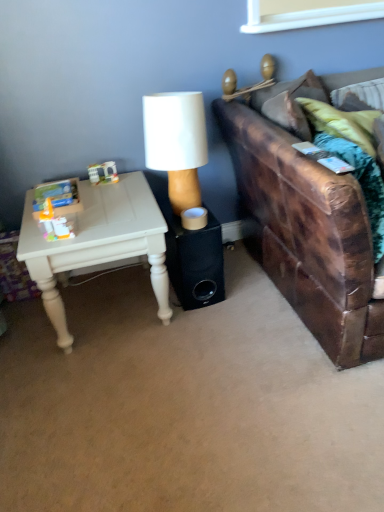
This screenshot has height=512, width=384. Describe the element at coordinates (176, 143) in the screenshot. I see `white matte lamp at center` at that location.

Image resolution: width=384 pixels, height=512 pixels. What do you see at coordinates (98, 243) in the screenshot?
I see `white painted wood table at left` at bounding box center [98, 243].

From the picture: What is the approximate width of black matte speaker at center?

black matte speaker at center is 14.01 inches wide.

At what (x,y) coordinates should I click in order to perform the action: click on brown leather couch at right. Please return your answer as a coordinate pair (x, y). The image size is (384, 512). Looking at the image, I should click on (306, 225).

Find the location of `studio couch beneath the white matte lamp at center (from a real-world perspective)`. studio couch beneath the white matte lamp at center (from a real-world perspective) is located at coordinates (306, 225).

Which is more to the left, white matte lamp at center or brown leather couch at right?

From the viewer's perspective, white matte lamp at center appears more on the left side.

From the image's perspective, is white matte lamp at center above brown leather couch at right?

Indeed, from the image's perspective, white matte lamp at center is shown above brown leather couch at right.

Is white matte lamp at center looking in the opposite direction of brown leather couch at right?

No, white matte lamp at center is not facing the opposite direction of brown leather couch at right.

Would you consider brown leather couch at right to be distant from white matte lamp at center?

That's not correct — brown leather couch at right is a little close to white matte lamp at center.

Which object is closer to the camera taking this photo, brown leather couch at right or white matte lamp at center?

Positioned in front is brown leather couch at right.

Which object is positioned more to the right, brown leather couch at right or white matte lamp at center?

Positioned to the right is brown leather couch at right.

Considering the sizes of brown leather couch at right and white matte lamp at center in the image, is brown leather couch at right taller or shorter than white matte lamp at center?

brown leather couch at right is taller than white matte lamp at center.

From the image's perspective, which is above, white painted wood table at left or black matte speaker at center?

black matte speaker at center.

Which is in front, point (93, 201) or point (196, 290)?

The point (93, 201) is closer.

Considering the relative positions of white painted wood table at left and black matte speaker at center in the image provided, is white painted wood table at left in front of black matte speaker at center?

Yes, the depth of white painted wood table at left is less than that of black matte speaker at center.

Which is more to the right, white painted wood table at left or black matte speaker at center?

black matte speaker at center.

Does brown leather couch at right have a greater width compared to black matte speaker at center?

Yes.

Does brown leather couch at right turn towards black matte speaker at center?

No.

From the image's perspective, is brown leather couch at right located above black matte speaker at center?

Yes, from the image's perspective, brown leather couch at right is on top of black matte speaker at center.

Consider the image. Considering the sizes of objects brown leather couch at right and black matte speaker at center in the image provided, who is shorter, brown leather couch at right or black matte speaker at center?

With less height is black matte speaker at center.

Is point (172, 238) in front of point (149, 158)?

Yes, point (172, 238) is closer to viewer.

From the image's perspective, which one is positioned lower, black matte speaker at center or white matte lamp at center?

black matte speaker at center.

At what (x,y) coordinates should I click in order to perform the action: click on speaker on the right of white matte lamp at center. Please return your answer as a coordinate pair (x, y). Looking at the image, I should click on (194, 261).

Could you tell me if black matte speaker at center is turned towards white matte lamp at center?

No, black matte speaker at center is not facing towards white matte lamp at center.

From a real-world perspective, is brown leather couch at right located beneath white painted wood table at left?

Actually, brown leather couch at right is physically above white painted wood table at left in the real world.

Considering the sizes of objects brown leather couch at right and white painted wood table at left in the image provided, who is bigger, brown leather couch at right or white painted wood table at left?

brown leather couch at right is bigger.

Consider the image. Is the position of brown leather couch at right less distant than that of white painted wood table at left?

Yes.

From the image's perspective, is brown leather couch at right under white painted wood table at left?

No.

From the image's perspective, is white painted wood table at left beneath white matte lamp at center?

Yes.

Is point (168, 298) closer to camera compared to point (177, 117)?

No, it is not.

You are a GUI agent. You are given a task and a screenshot of the screen. Output one action in this format:
    pyautogui.click(x=<x>, y=<y>)
    Task: Click on the table lamp that appears above the brown leather couch at right (from the image's perspective)
    This screenshot has width=384, height=512.
    Given the screenshot: What is the action you would take?
    pyautogui.click(x=176, y=143)

Image resolution: width=384 pixels, height=512 pixels. Identify the location of studio couch below the white matte lamp at center (from the image's perspective). (306, 225).

When comparing their distances from white painted wood table at left, does brown leather couch at right or white matte lamp at center seem closer?

Among the two, white matte lamp at center is located nearer to white painted wood table at left.

Based on their spatial positions, is black matte speaker at center or brown leather couch at right closer to white painted wood table at left?

Among the two, black matte speaker at center is located nearer to white painted wood table at left.

Consider the image. From the image, which object appears to be farther from black matte speaker at center, white matte lamp at center or brown leather couch at right?

brown leather couch at right is positioned further to the anchor black matte speaker at center.

Estimate the real-world distances between objects in this image. Which object is further from black matte speaker at center, brown leather couch at right or white matte lamp at center?

Based on the image, brown leather couch at right appears to be further to black matte speaker at center.

When comparing their distances from brown leather couch at right, does white matte lamp at center or white painted wood table at left seem further?

white painted wood table at left lies further to brown leather couch at right than the other object.

Estimate the real-world distances between objects in this image. Which object is closer to black matte speaker at center, white painted wood table at left or brown leather couch at right?

white painted wood table at left is positioned closer to the anchor black matte speaker at center.

Which object lies further to the anchor point white matte lamp at center, black matte speaker at center or brown leather couch at right?

Based on the image, brown leather couch at right appears to be further to white matte lamp at center.

Which object lies nearer to the anchor point white matte lamp at center, white painted wood table at left or brown leather couch at right?

Based on the image, white painted wood table at left appears to be nearer to white matte lamp at center.

You are a GUI agent. You are given a task and a screenshot of the screen. Output one action in this format:
    pyautogui.click(x=<x>, y=<y>)
    Task: Click on the speaker located between white painted wood table at left and brown leather couch at right in the left-right direction
    The width and height of the screenshot is (384, 512).
    Given the screenshot: What is the action you would take?
    pyautogui.click(x=194, y=261)

The height and width of the screenshot is (512, 384). Identify the location of speaker between white matte lamp at center and white painted wood table at left vertically. (194, 261).

The image size is (384, 512). I want to click on speaker located between white matte lamp at center and brown leather couch at right in the left-right direction, so click(194, 261).

The width and height of the screenshot is (384, 512). Identify the location of table lamp located between white painted wood table at left and brown leather couch at right in the left-right direction. (176, 143).